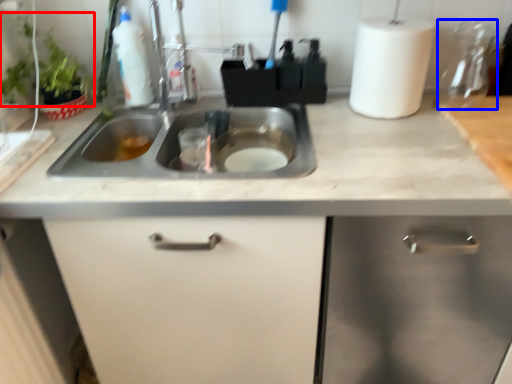
Question: Which of the following is the closest to the observer, plant (highlighted by a red box) or appliance (highlighted by a blue box)?

Choices:
 (A) plant
 (B) appliance

Answer: (A)